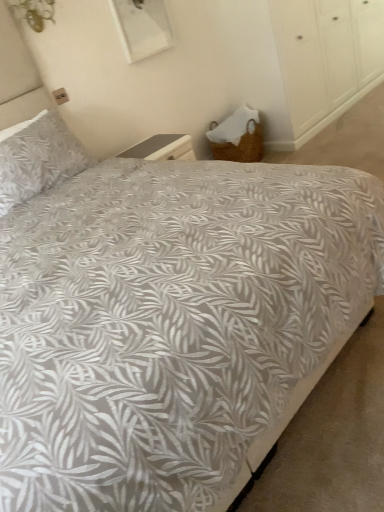
This screenshot has width=384, height=512. What do you see at coordinates (325, 59) in the screenshot? I see `woven wicker basket at lower right` at bounding box center [325, 59].

Measure the distance between point (343, 92) and camera.

Point (343, 92) is 3.99 meters from camera.

Where is `woven wicker basket at lower right`? The height and width of the screenshot is (512, 384). woven wicker basket at lower right is located at coordinates (325, 59).

The image size is (384, 512). Find the location of `gray leaf-patterned pillow at upper left`. gray leaf-patterned pillow at upper left is located at coordinates (38, 159).

The image size is (384, 512). Describe the element at coordinates (38, 159) in the screenshot. I see `gray leaf-patterned pillow at upper left` at that location.

This screenshot has height=512, width=384. What are the coordinates of `woven wicker basket at lower right` in the screenshot? It's located at [325, 59].

Does woven wicker basket at lower right appear on the right side of gray leaf-patterned pillow at upper left?

Yes.

Is woven wicker basket at lower right in front of gray leaf-patterned pillow at upper left?

No.

Which is in front, point (307, 59) or point (22, 151)?

The point (22, 151) is in front.

From the image's perspective, which one is positioned lower, woven wicker basket at lower right or gray leaf-patterned pillow at upper left?

gray leaf-patterned pillow at upper left is shown below in the image.

From a real-world perspective, who is located higher, woven wicker basket at lower right or gray leaf-patterned pillow at upper left?

gray leaf-patterned pillow at upper left, from a real-world perspective.

Does woven wicker basket at lower right have a greater width compared to gray leaf-patterned pillow at upper left?

Yes, woven wicker basket at lower right is wider than gray leaf-patterned pillow at upper left.

Considering the sizes of objects woven wicker basket at lower right and gray leaf-patterned pillow at upper left in the image provided, who is taller, woven wicker basket at lower right or gray leaf-patterned pillow at upper left?

woven wicker basket at lower right is taller.

In the scene shown: Which of these two, woven wicker basket at lower right or gray leaf-patterned pillow at upper left, is bigger?

With larger size is woven wicker basket at lower right.

Which is correct: woven wicker basket at lower right is inside gray leaf-patterned pillow at upper left, or outside of it?

woven wicker basket at lower right exists outside the volume of gray leaf-patterned pillow at upper left.

Is woven wicker basket at lower right next to gray leaf-patterned pillow at upper left and touching it?

No, woven wicker basket at lower right is not next to gray leaf-patterned pillow at upper left.

Is woven wicker basket at lower right facing towards gray leaf-patterned pillow at upper left?

No, woven wicker basket at lower right does not turn towards gray leaf-patterned pillow at upper left.

How different are the orientations of woven wicker basket at lower right and gray leaf-patterned pillow at upper left in degrees?

0.85 degrees.

Measure the distance between woven wicker basket at lower right and gray leaf-patterned pillow at upper left.

woven wicker basket at lower right is 7.50 feet from gray leaf-patterned pillow at upper left.

Find the location of a particular element. The height and width of the screenshot is (512, 384). dresser on the right of gray leaf-patterned pillow at upper left is located at coordinates (325, 59).

Would you say gray leaf-patterned pillow at upper left is to the left or to the right of woven wicker basket at lower right in the picture?

gray leaf-patterned pillow at upper left is positioned on woven wicker basket at lower right's left side.

Considering the positions of objects gray leaf-patterned pillow at upper left and woven wicker basket at lower right in the image provided, who is in front, gray leaf-patterned pillow at upper left or woven wicker basket at lower right?

gray leaf-patterned pillow at upper left is more forward.

Does point (25, 148) appear closer or farther from the camera than point (318, 62)?

Point (25, 148) is closer to the camera than point (318, 62).

From the image's perspective, is gray leaf-patterned pillow at upper left located beneath woven wicker basket at lower right?

Yes.

From a real-world perspective, is gray leaf-patterned pillow at upper left positioned over woven wicker basket at lower right based on gravity?

Yes.

Considering the relative sizes of gray leaf-patterned pillow at upper left and woven wicker basket at lower right in the image provided, is gray leaf-patterned pillow at upper left thinner than woven wicker basket at lower right?

Yes, gray leaf-patterned pillow at upper left is thinner than woven wicker basket at lower right.

Consider the image. Who is shorter, gray leaf-patterned pillow at upper left or woven wicker basket at lower right?

gray leaf-patterned pillow at upper left is shorter.

In terms of size, does gray leaf-patterned pillow at upper left appear bigger or smaller than woven wicker basket at lower right?

In the image, gray leaf-patterned pillow at upper left appears to be smaller than woven wicker basket at lower right.

In the scene shown: Choose the correct answer: Is gray leaf-patterned pillow at upper left inside woven wicker basket at lower right or outside it?

gray leaf-patterned pillow at upper left is not inside woven wicker basket at lower right, it's outside.

Are gray leaf-patterned pillow at upper left and woven wicker basket at lower right far apart?

Yes, gray leaf-patterned pillow at upper left and woven wicker basket at lower right are quite far apart.

Is gray leaf-patterned pillow at upper left positioned with its back to woven wicker basket at lower right?

That's not correct — gray leaf-patterned pillow at upper left is not looking away from woven wicker basket at lower right.

How many degrees apart are the facing directions of gray leaf-patterned pillow at upper left and woven wicker basket at lower right?

They differ by 0.85 degrees in their facing directions.

What are the coordinates of `pillow on the left of woven wicker basket at lower right` in the screenshot? It's located at (38, 159).

Where is `pillow below the woven wicker basket at lower right (from the image's perspective)`? pillow below the woven wicker basket at lower right (from the image's perspective) is located at coordinates (38, 159).

Locate an element on the screen. This screenshot has height=512, width=384. dresser located underneath the gray leaf-patterned pillow at upper left (from a real-world perspective) is located at coordinates (325, 59).